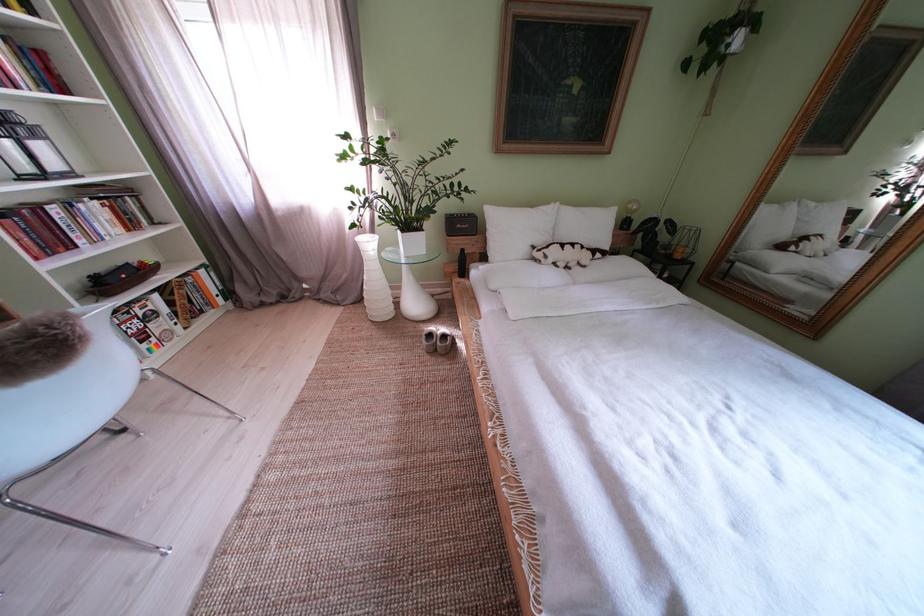
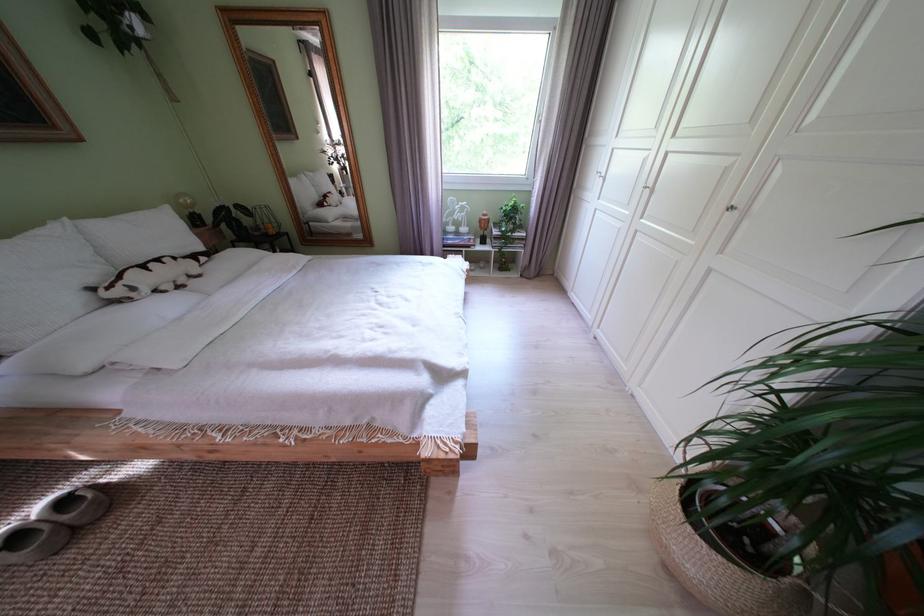
Locate, in the second image, the point that corresponds to (x=556, y=262) in the first image.

(146, 294)